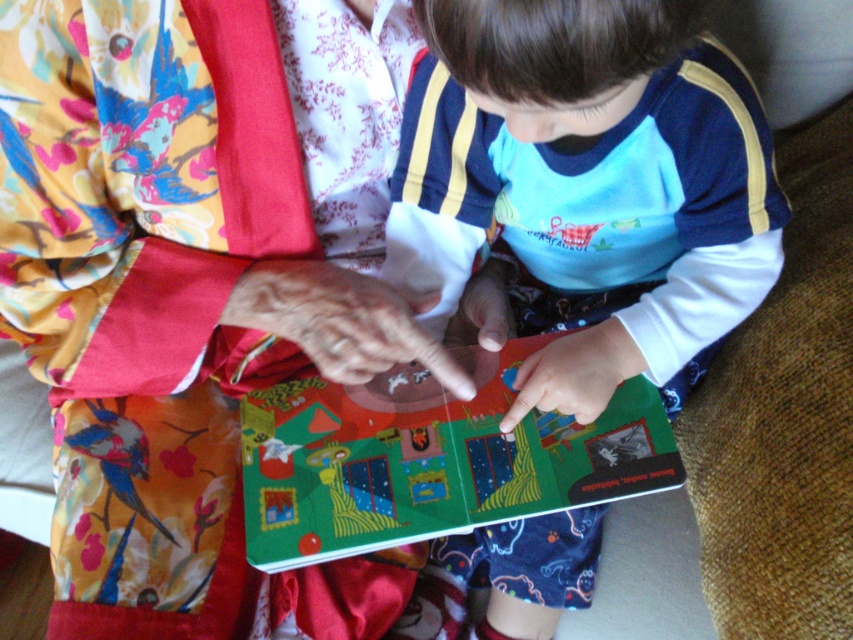
You are a parent trying to locate the book your child is pointing at. The book is at point (589, 182). Can you describe where exactly the book is located in the scene?

The book is located at point (589, 182), which is the center of the scene.

From the picture: You are a tailor who needs to determine which item is more suitable for a child to handle. Based on the sizes provided, which object between the floral silk kimono at center and the matte green book at center is smaller?

The floral silk kimono at center is smaller than the matte green book at center, making it more suitable for a child to handle.

What is located at the coordinates point [158,307]?

The floral silk kimono at center is located at point [158,307].